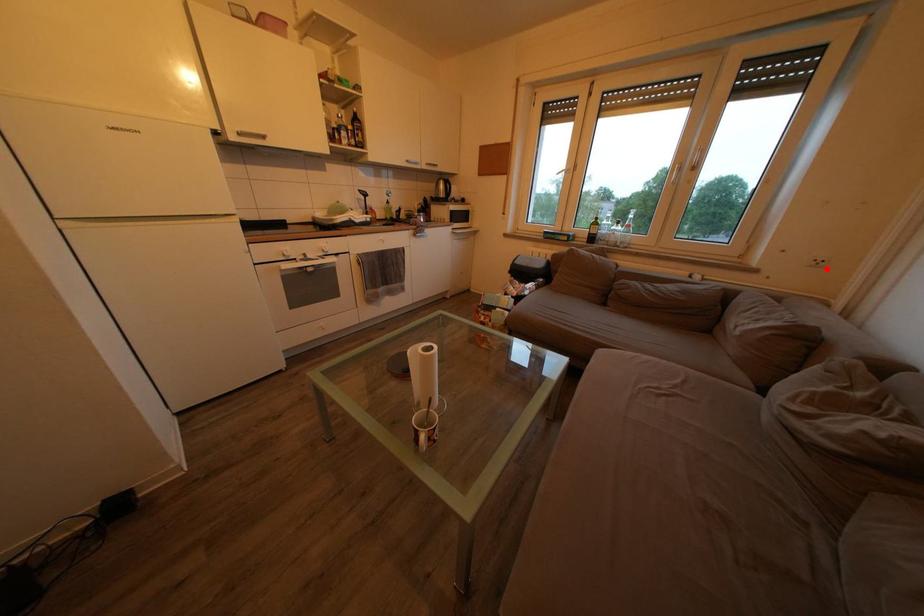
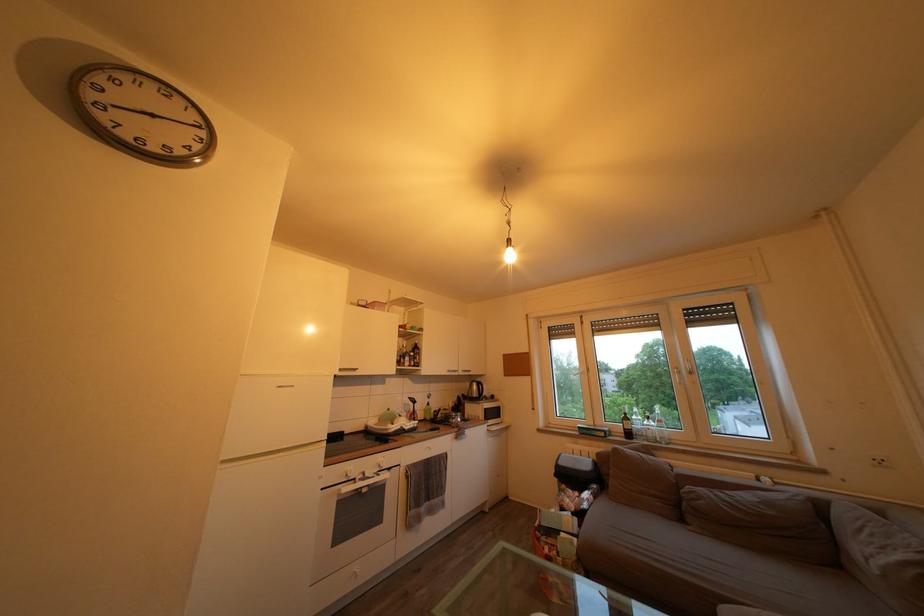
Question: I am providing you with two images of the same scene from different viewpoints. Image1 has a red point marked. In image2, the corresponding 3D location appears at what relative position? Reply with the corresponding letter.

Choices:
 (A) Closer
 (B) Farther

Answer: (A)